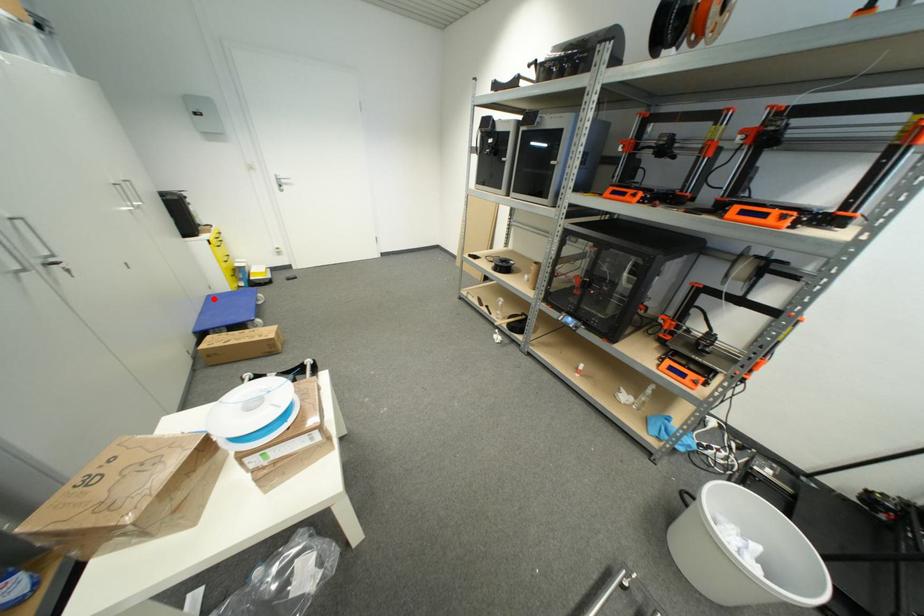
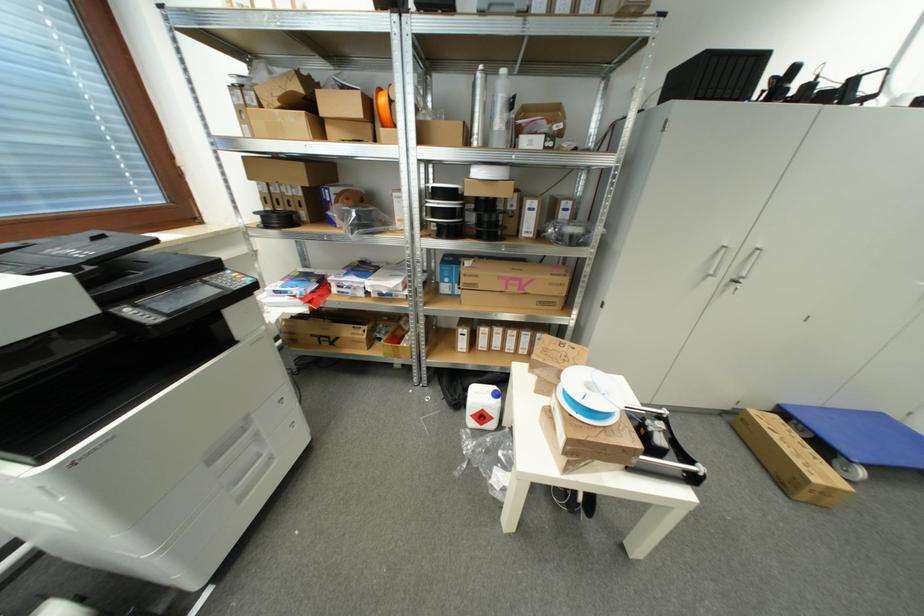
Question: I am providing you with two images of the same scene from different viewpoints. Image1 has a red point marked. In image2, the corresponding 3D location appears at what relative position? Reply with the corresponding letter.

Choices:
 (A) Closer
 (B) Farther

Answer: (B)